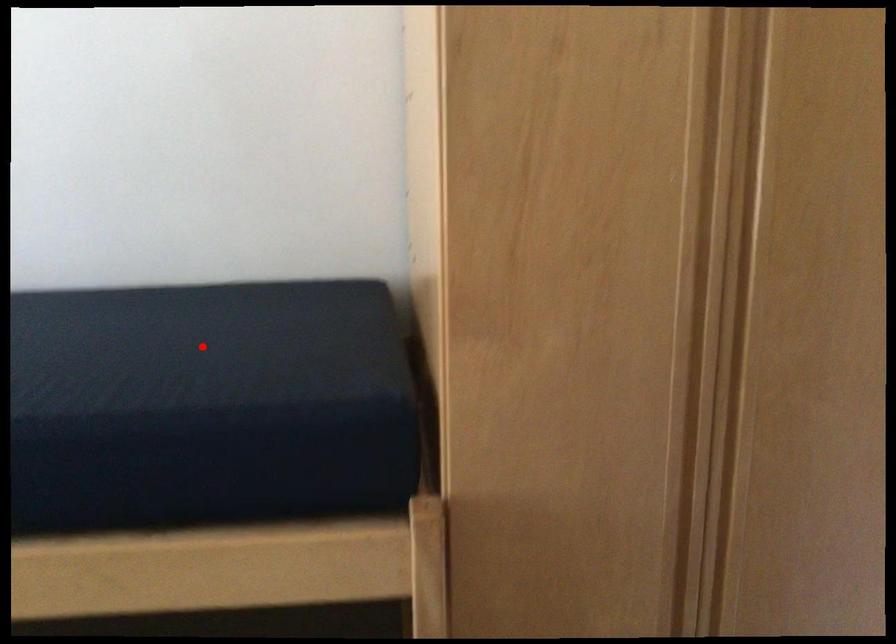
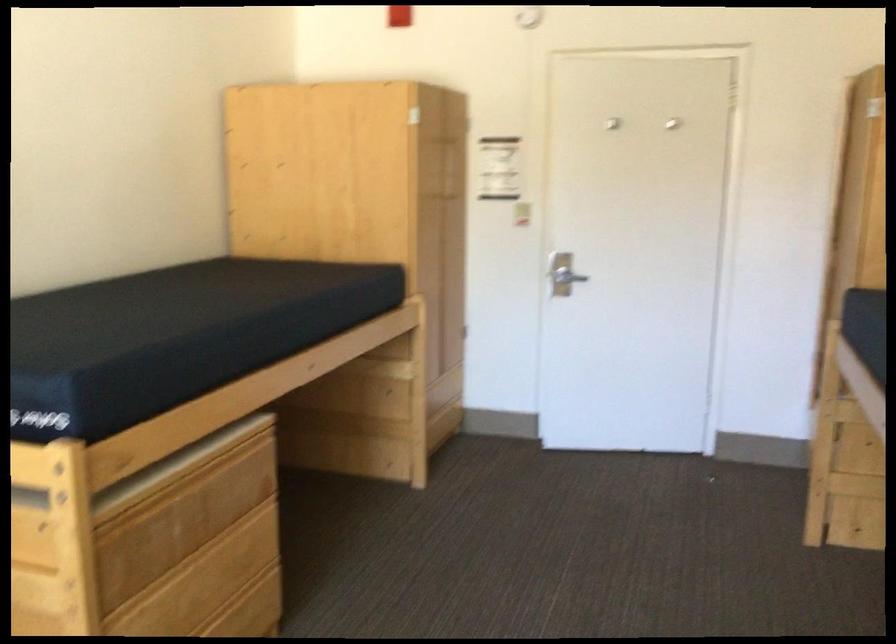
Locate, in the second image, the point that corresponds to the highlighted location in the first image.

(314, 261)